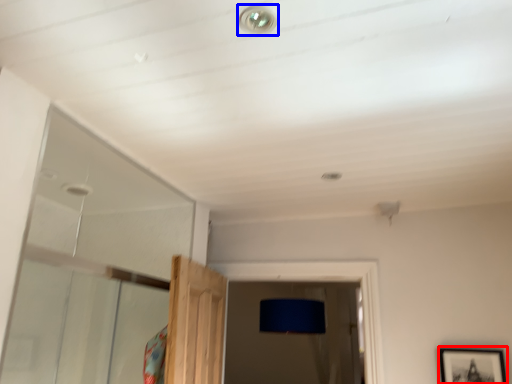
Question: Among these objects, which one is farthest to the camera, picture frame (highlighted by a red box) or droplight (highlighted by a blue box)?

Choices:
 (A) picture frame
 (B) droplight

Answer: (A)